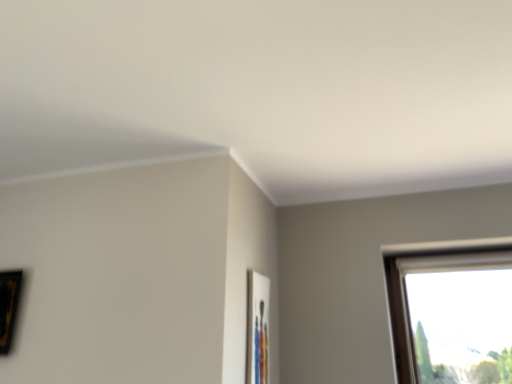
Question: Does matte wooden picture frame at center-right, marked as the 1th picture frame in a right-to-left arrangement, have a greater width compared to wooden picture frame at left, the 1th picture frame from the left?

Choices:
 (A) no
 (B) yes

Answer: (A)

Question: Does matte wooden picture frame at center-right, marked as the second picture frame in a left-to-right arrangement, have a lesser width compared to wooden picture frame at left, which is counted as the 2th picture frame, starting from the right?

Choices:
 (A) yes
 (B) no

Answer: (A)

Question: Is matte wooden picture frame at center-right, marked as the 1th picture frame in a right-to-left arrangement, outside of wooden picture frame at left, which is counted as the 2th picture frame, starting from the right?

Choices:
 (A) yes
 (B) no

Answer: (A)

Question: Is matte wooden picture frame at center-right, marked as the 1th picture frame in a right-to-left arrangement, to the left of wooden picture frame at left, the 1th picture frame from the left, from the viewer's perspective?

Choices:
 (A) no
 (B) yes

Answer: (A)

Question: From a real-world perspective, is matte wooden picture frame at center-right, marked as the second picture frame in a left-to-right arrangement, located higher than wooden picture frame at left, the 1th picture frame from the left?

Choices:
 (A) yes
 (B) no

Answer: (B)

Question: Can you confirm if matte wooden picture frame at center-right, marked as the second picture frame in a left-to-right arrangement, is bigger than wooden picture frame at left, which is counted as the 2th picture frame, starting from the right?

Choices:
 (A) no
 (B) yes

Answer: (A)

Question: Is matte wooden picture frame at center-right, marked as the 1th picture frame in a right-to-left arrangement, at the back of wooden picture frame at left, the 1th picture frame from the left?

Choices:
 (A) no
 (B) yes

Answer: (A)

Question: Is wooden picture frame at left, which is counted as the 2th picture frame, starting from the right, to the left of matte wooden picture frame at center-right, marked as the 1th picture frame in a right-to-left arrangement, from the viewer's perspective?

Choices:
 (A) no
 (B) yes

Answer: (B)

Question: From a real-world perspective, is wooden picture frame at left, which is counted as the 2th picture frame, starting from the right, on matte wooden picture frame at center-right, marked as the second picture frame in a left-to-right arrangement?

Choices:
 (A) yes
 (B) no

Answer: (A)

Question: Is the position of wooden picture frame at left, which is counted as the 2th picture frame, starting from the right, less distant than that of matte wooden picture frame at center-right, marked as the second picture frame in a left-to-right arrangement?

Choices:
 (A) yes
 (B) no

Answer: (B)

Question: Would you consider wooden picture frame at left, which is counted as the 2th picture frame, starting from the right, to be distant from matte wooden picture frame at center-right, marked as the second picture frame in a left-to-right arrangement?

Choices:
 (A) yes
 (B) no

Answer: (A)

Question: From a real-world perspective, is wooden picture frame at left, the 1th picture frame from the left, physically below matte wooden picture frame at center-right, marked as the second picture frame in a left-to-right arrangement?

Choices:
 (A) yes
 (B) no

Answer: (B)

Question: From the image's perspective, is wooden picture frame at left, which is counted as the 2th picture frame, starting from the right, positioned above or below matte wooden picture frame at center-right, marked as the 1th picture frame in a right-to-left arrangement?

Choices:
 (A) below
 (B) above

Answer: (B)